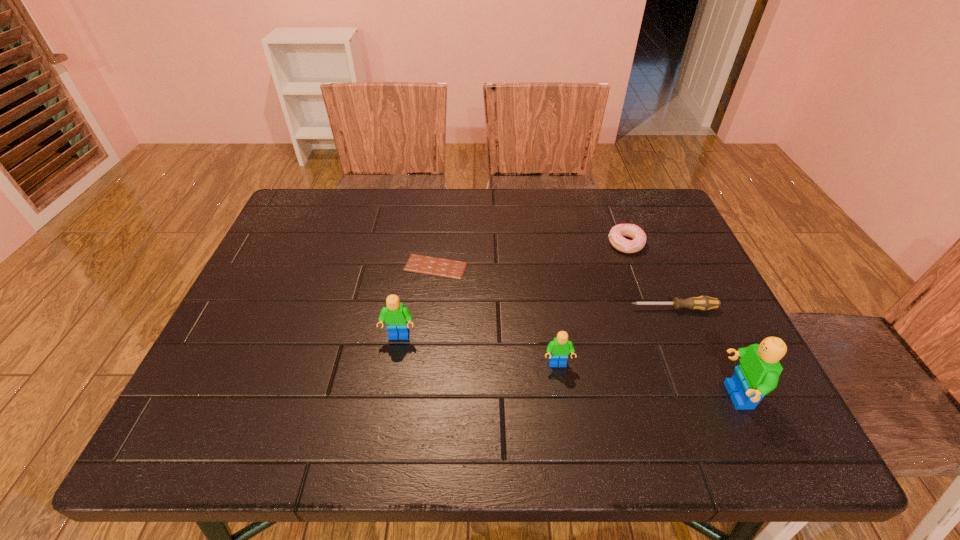
Find the location of a particular element. The height and width of the screenshot is (540, 960). Lego that is at the right edge is located at coordinates (757, 375).

Locate an element on the screen. doughnut present at the right edge is located at coordinates pyautogui.click(x=616, y=234).

What are the coordinates of `screwdriver at the right edge` in the screenshot? It's located at (704, 303).

Where is `object that is at the far right corner`? object that is at the far right corner is located at coordinates (616, 234).

The image size is (960, 540). What are the coordinates of `object at the near right corner` in the screenshot? It's located at (757, 375).

Find the location of `free space at the far edge of the desktop`. free space at the far edge of the desktop is located at coordinates (564, 200).

Identify the location of vacant region at the near edge. This screenshot has width=960, height=540. (484, 391).

I want to click on vacant region at the left edge of the desktop, so click(x=295, y=240).

This screenshot has height=540, width=960. In the image, there is a desktop. Find the location of `vacant space at the right edge`. vacant space at the right edge is located at coordinates coord(662,333).

In the image, there is a desktop. Where is `vacant space at the near left corner`? vacant space at the near left corner is located at coordinates (239, 375).